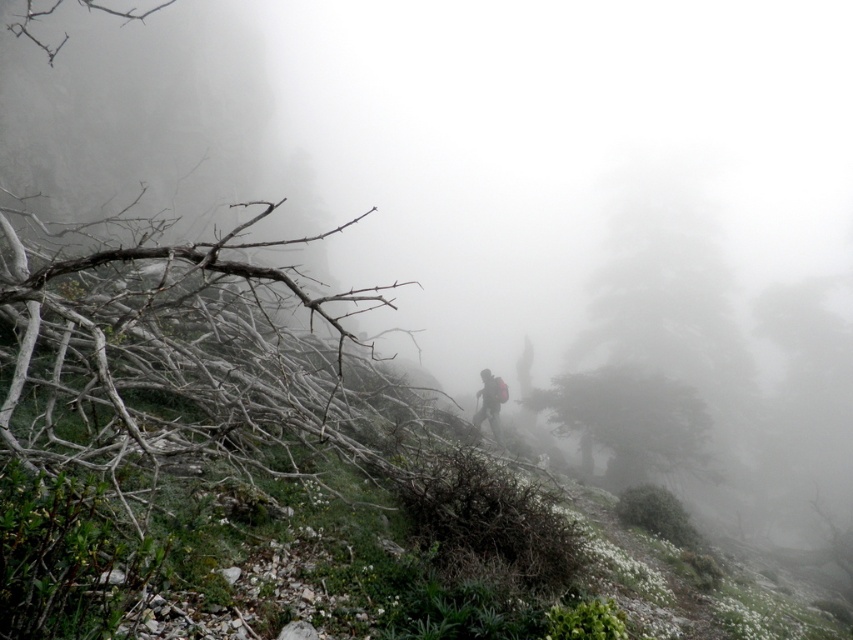
Question: Which object appears closest to the camera in this image?

Choices:
 (A) dark green textured tree at center
 (B) dark gray fabric backpack at center
 (C) green matte tree at center

Answer: (B)

Question: Is dark green textured tree at center further to the viewer compared to green matte tree at center?

Choices:
 (A) yes
 (B) no

Answer: (A)

Question: Estimate the real-world distances between objects in this image. Which object is closer to the dark gray fabric backpack at center?

Choices:
 (A) dark green textured tree at center
 (B) green matte tree at center

Answer: (B)

Question: Does dark green textured tree at center appear under green matte tree at center?

Choices:
 (A) yes
 (B) no

Answer: (B)

Question: Which of the following is the closest to the observer?

Choices:
 (A) dark gray fabric backpack at center
 (B) green matte tree at center
 (C) dark green textured tree at center

Answer: (A)

Question: Can you confirm if dark green textured tree at center is thinner than dark gray fabric backpack at center?

Choices:
 (A) yes
 (B) no

Answer: (B)